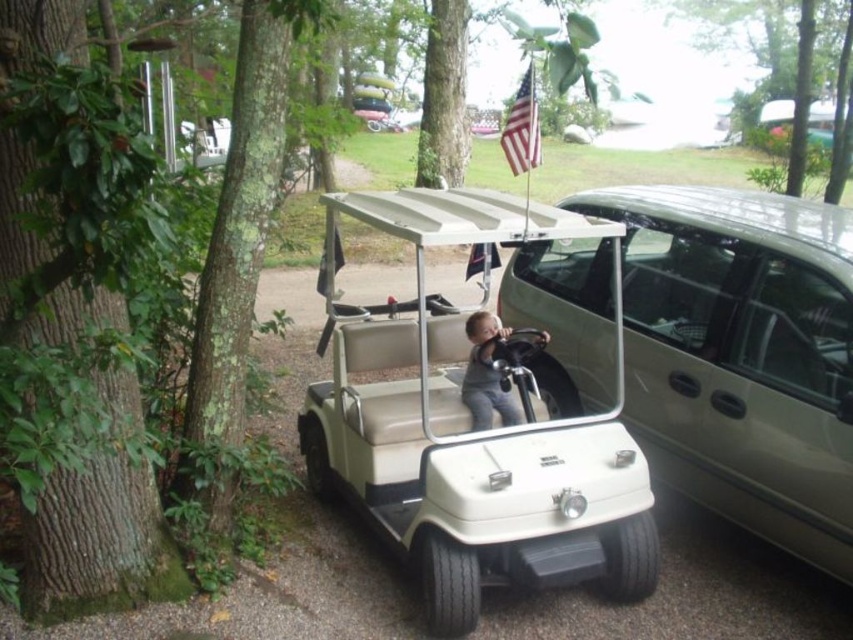
You are standing at the edge of a gravel path in the park. You see a matte gray minivan at center and a gray matte shirt at center. Which object is closer to you?

The matte gray minivan at center is closer to you because it is positioned in front of the gray matte shirt at center.

You are a parent trying to ensure your child stays safe while playing near the green leafy tree at left and the gray matte shirt at center. Which object is taller and could potentially block the view if standing behind it?

The green leafy tree at left is taller than the gray matte shirt at center, so standing behind the green leafy tree at left could block the view more than the gray matte shirt at center.